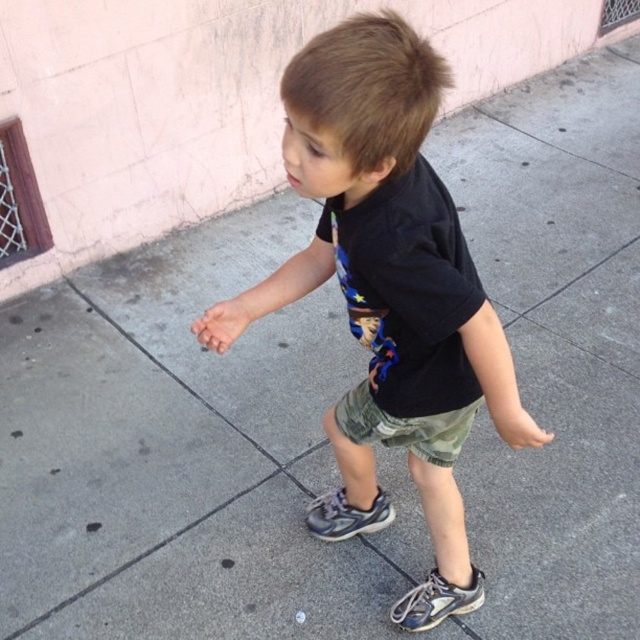
Between camo fabric shorts at center and gray mesh shoe at lower center, which one appears on the right side from the viewer's perspective?

From the viewer's perspective, gray mesh shoe at lower center appears more on the right side.

Can you confirm if camo fabric shorts at center is thinner than gray mesh shoe at lower center?

Incorrect, camo fabric shorts at center's width is not less than gray mesh shoe at lower center's.

Between point (340, 406) and point (440, 621), which one is positioned in front?

Point (340, 406) is more forward.

The height and width of the screenshot is (640, 640). I want to click on camo fabric shorts at center, so click(403, 426).

Is gray mesh shoe at lower center above gray suede sneaker at center?

Incorrect, gray mesh shoe at lower center is not positioned above gray suede sneaker at center.

Between gray mesh shoe at lower center and gray suede sneaker at center, which one is positioned higher?

gray suede sneaker at center is above.

Is point (483, 576) positioned in front of point (365, 524)?

Yes, point (483, 576) is closer to viewer.

The height and width of the screenshot is (640, 640). What are the coordinates of `gray mesh shoe at lower center` in the screenshot? It's located at click(x=436, y=602).

Where is `black cotton shirt at center`? black cotton shirt at center is located at coordinates (387, 269).

Which is more to the right, black cotton shirt at center or gray suede sneaker at center?

black cotton shirt at center

Which is behind, point (403, 269) or point (381, 520)?

Point (381, 520)

Where is `black cotton shirt at center`? This screenshot has height=640, width=640. black cotton shirt at center is located at coordinates (387, 269).